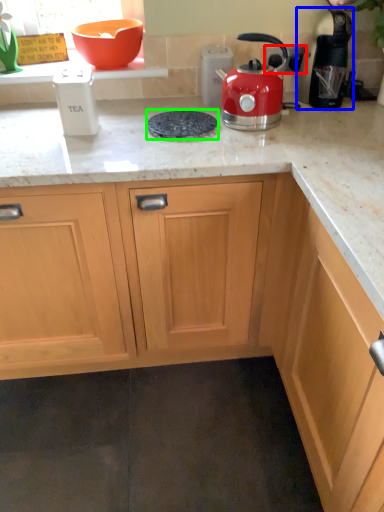
Question: Based on their relative distances, which object is farther from electric outlet (highlighted by a red box)? Choose from kitchen appliance (highlighted by a blue box) and gas stove (highlighted by a green box).

Choices:
 (A) kitchen appliance
 (B) gas stove

Answer: (B)